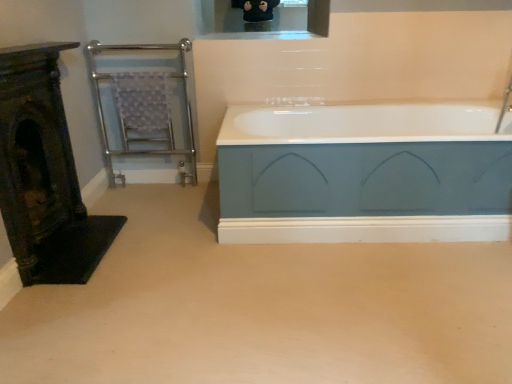
Question: Could you tell me if chrome/metallic towel rail at left is facing dark green ornate fireplace at left?

Choices:
 (A) no
 (B) yes

Answer: (B)

Question: Is chrome/metallic towel rail at left in front of dark green ornate fireplace at left?

Choices:
 (A) no
 (B) yes

Answer: (A)

Question: Does chrome/metallic towel rail at left contain dark green ornate fireplace at left?

Choices:
 (A) yes
 (B) no

Answer: (B)

Question: Can you confirm if chrome/metallic towel rail at left is wider than dark green ornate fireplace at left?

Choices:
 (A) no
 (B) yes

Answer: (B)

Question: From a real-world perspective, is chrome/metallic towel rail at left under dark green ornate fireplace at left?

Choices:
 (A) no
 (B) yes

Answer: (A)

Question: In the image, is teal matte bathtub at center positioned in front of or behind chrome/metallic towel rail at left?

Choices:
 (A) front
 (B) behind

Answer: (A)

Question: From the image's perspective, relative to chrome/metallic towel rail at left, is teal matte bathtub at center above or below?

Choices:
 (A) above
 (B) below

Answer: (B)

Question: In the image, is teal matte bathtub at center on the left side or the right side of chrome/metallic towel rail at left?

Choices:
 (A) right
 (B) left

Answer: (A)

Question: From a real-world perspective, relative to chrome/metallic towel rail at left, is teal matte bathtub at center vertically above or below?

Choices:
 (A) above
 (B) below

Answer: (B)

Question: Considering their positions, is dark green ornate fireplace at left located in front of or behind chrome/metallic towel rail at left?

Choices:
 (A) behind
 (B) front

Answer: (B)

Question: From the image's perspective, relative to chrome/metallic towel rail at left, is dark green ornate fireplace at left above or below?

Choices:
 (A) above
 (B) below

Answer: (B)

Question: Would you say dark green ornate fireplace at left is inside or outside chrome/metallic towel rail at left?

Choices:
 (A) outside
 (B) inside

Answer: (A)

Question: Is dark green ornate fireplace at left wider or thinner than chrome/metallic towel rail at left?

Choices:
 (A) thin
 (B) wide

Answer: (A)

Question: From their relative heights in the image, would you say dark green ornate fireplace at left is taller or shorter than teal matte bathtub at center?

Choices:
 (A) short
 (B) tall

Answer: (B)

Question: Is dark green ornate fireplace at left bigger or smaller than teal matte bathtub at center?

Choices:
 (A) small
 (B) big

Answer: (A)